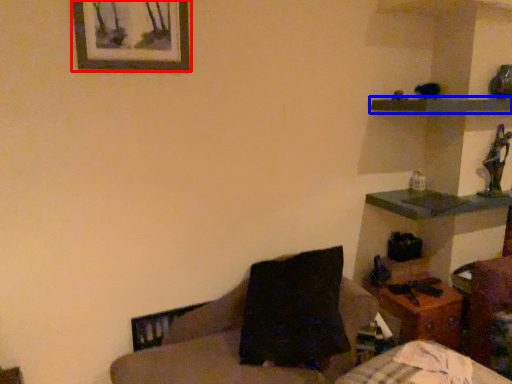
Question: Which object is further to the camera taking this photo, picture frame (highlighted by a red box) or shelf (highlighted by a blue box)?

Choices:
 (A) picture frame
 (B) shelf

Answer: (B)